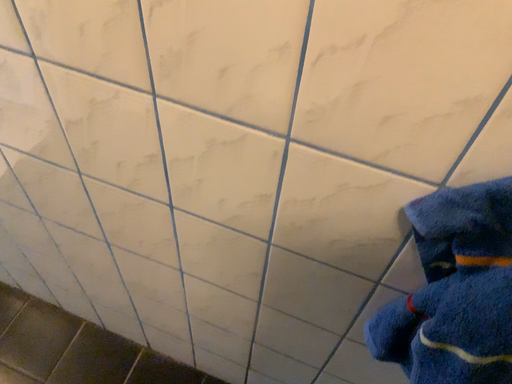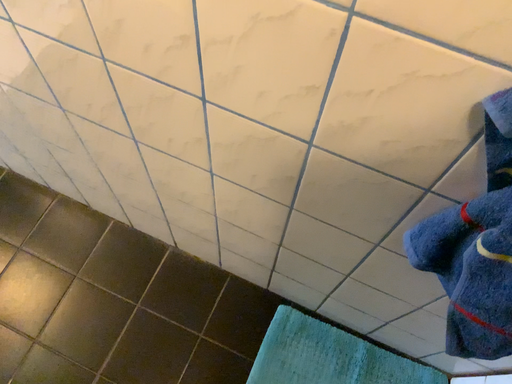
Question: Which way did the camera rotate in the video?

Choices:
 (A) rotated upward
 (B) rotated downward

Answer: (B)